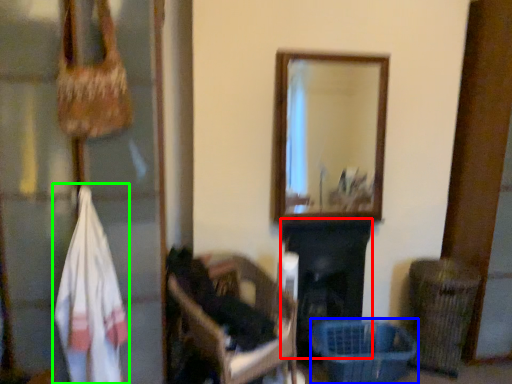
Question: Estimate the real-world distances between objects in this image. Which object is farther from fireplace (highlighted by a red box), basket (highlighted by a blue box) or clothing (highlighted by a green box)?

Choices:
 (A) basket
 (B) clothing

Answer: (B)